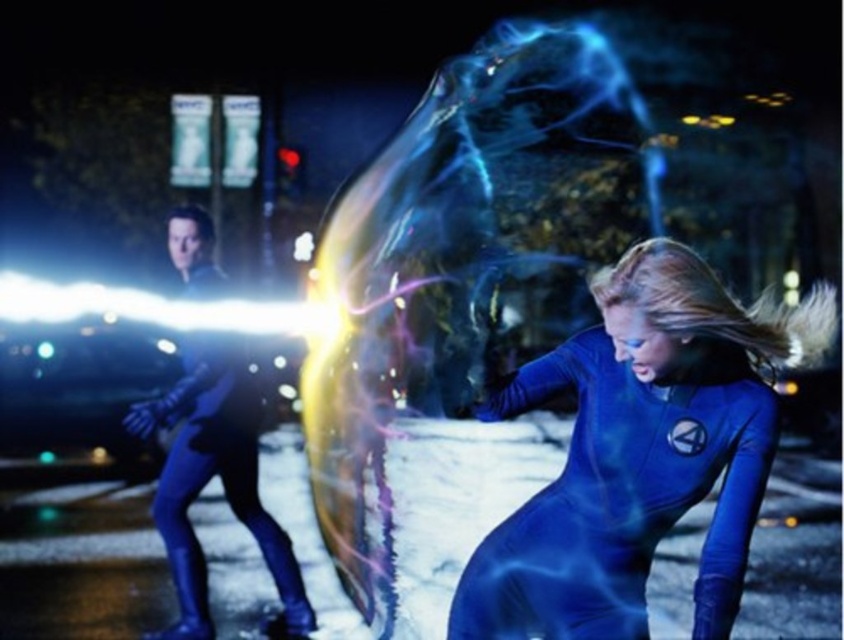
You are a photographer trying to capture the scene. The blue spandex suit at lower right and the matte blue suit at left are both in your viewfinder. Which one is positioned higher in the frame?

The blue spandex suit at lower right is positioned higher in the frame than the matte blue suit at left because it is located above it according to the description.

You are a character in the scene and need to move from point A to point B. Point A is located at coordinates point (x=729, y=410) and point B is at point (x=253, y=499). Given that point A is closer to you, which direction should you move to reach point B?

Since point A is closer to you than point B, you should move towards the direction away from your current position to reach point B.